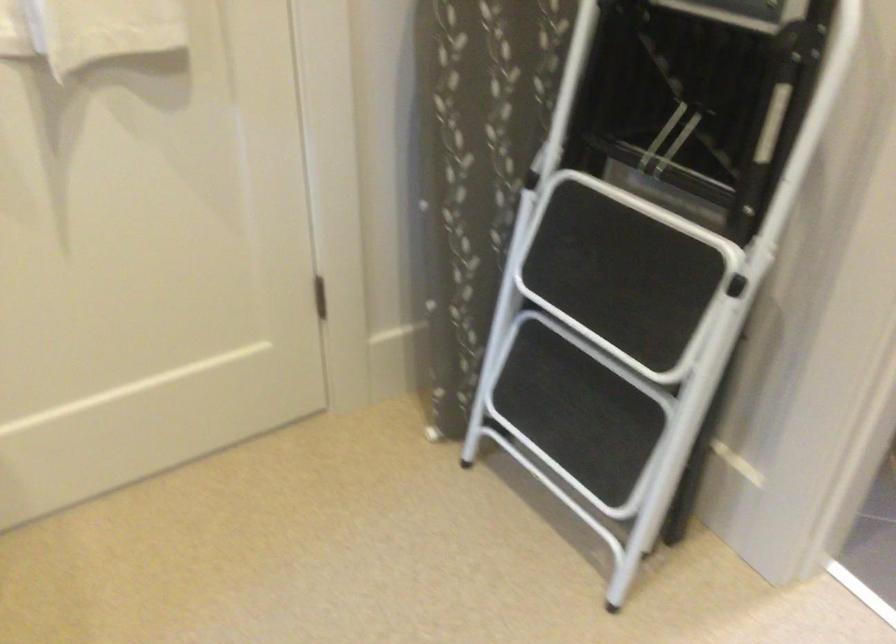
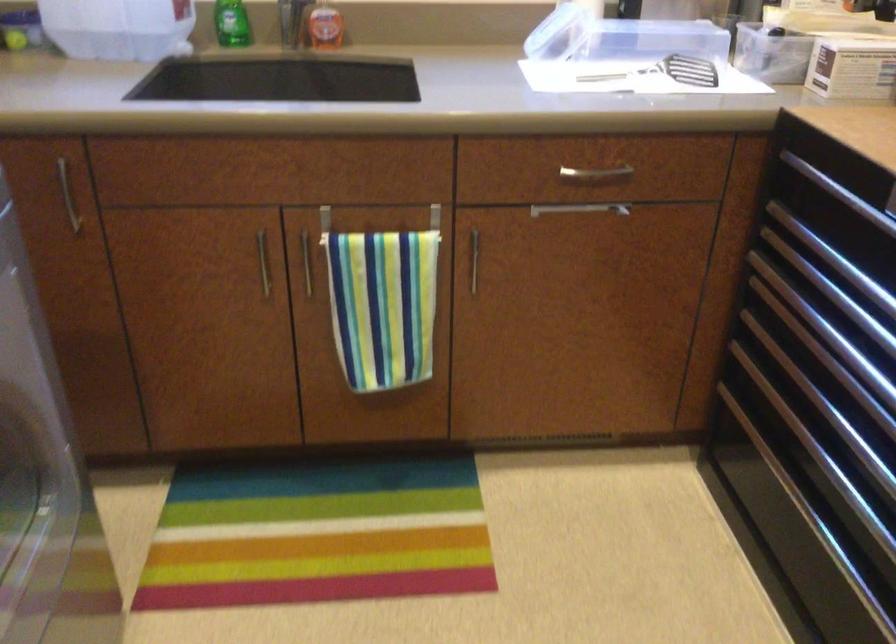
The first image is from the beginning of the video and the second image is from the end. How did the camera likely rotate when shooting the video?

The rotation direction of the camera is left-down.